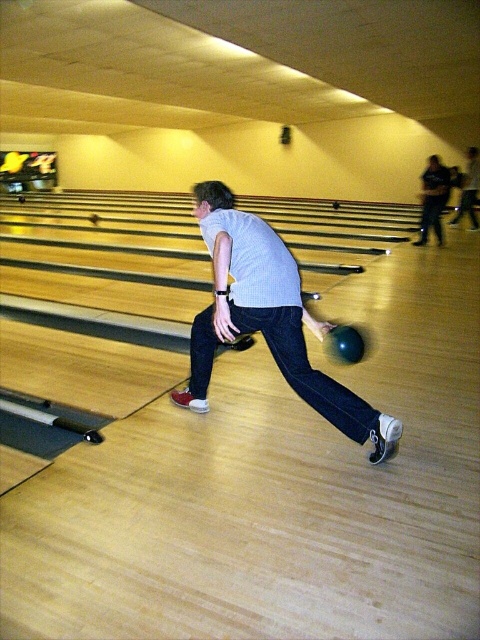
You are standing at the front of the bowling lane and see two points marked on the lane ahead of you. Which point is closer to you, point [243,291] or point [450,220]?

Point [243,291] is closer to the viewer than point [450,220].

You are a photographer trying to capture the bowler in action. You notice the matte gray shirt at center and the dark blue jeans at upper right. Which object should you focus on first to ensure the bowler is in sharp focus?

The matte gray shirt at center is in front of the dark blue jeans at upper right, so you should focus on the matte gray shirt at center first to ensure the bowler is in sharp focus.